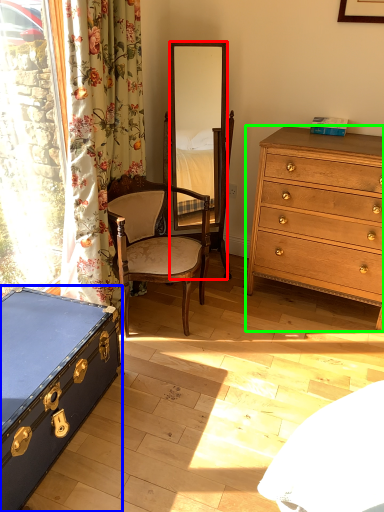
Question: Considering the real-world distances, which object is farthest from mirror (highlighted by a red box)? box (highlighted by a blue box) or chest of drawers (highlighted by a green box)?

Choices:
 (A) box
 (B) chest of drawers

Answer: (A)